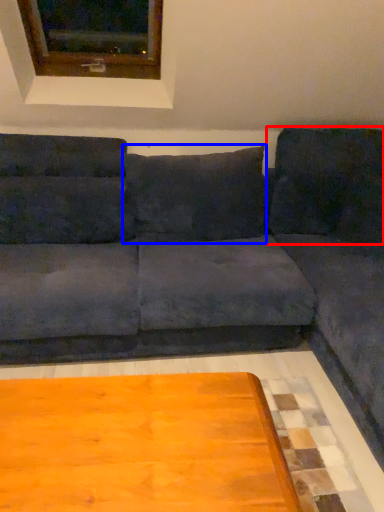
Question: Which of the following is the closest to the observer, pillow (highlighted by a red box) or pillow (highlighted by a blue box)?

Choices:
 (A) pillow
 (B) pillow

Answer: (B)